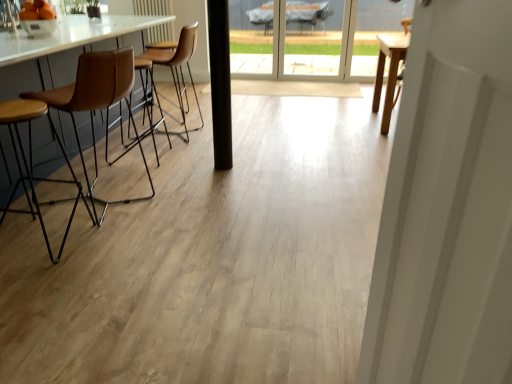
The height and width of the screenshot is (384, 512). I want to click on free point to the right of brown leather stool at left, positioned as the second chair in front-to-back order, so click(186, 202).